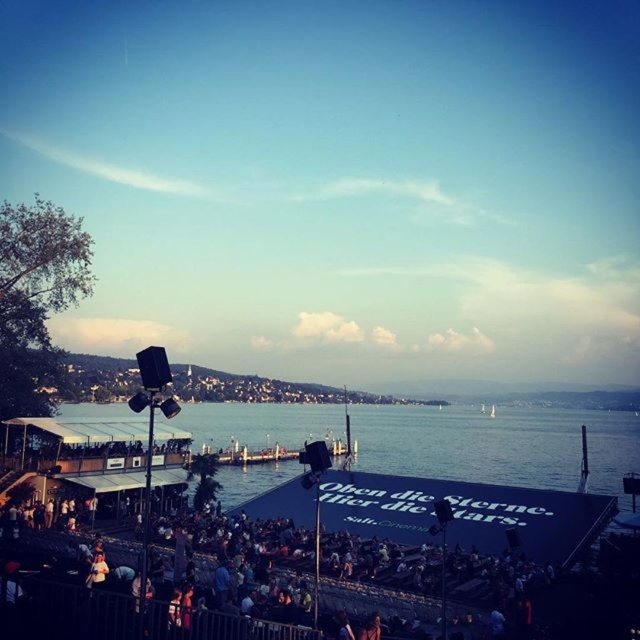
Question: Is the position of blue water at lower center more distant than that of dark gray crowd at lower center?

Choices:
 (A) no
 (B) yes

Answer: (B)

Question: Does blue water at lower center come in front of dark gray crowd at lower center?

Choices:
 (A) no
 (B) yes

Answer: (A)

Question: Does blue water at lower center appear over dark gray crowd at lower center?

Choices:
 (A) yes
 (B) no

Answer: (B)

Question: Among these points, which one is farthest from the camera?

Choices:
 (A) (572, 531)
 (B) (259, 596)

Answer: (A)